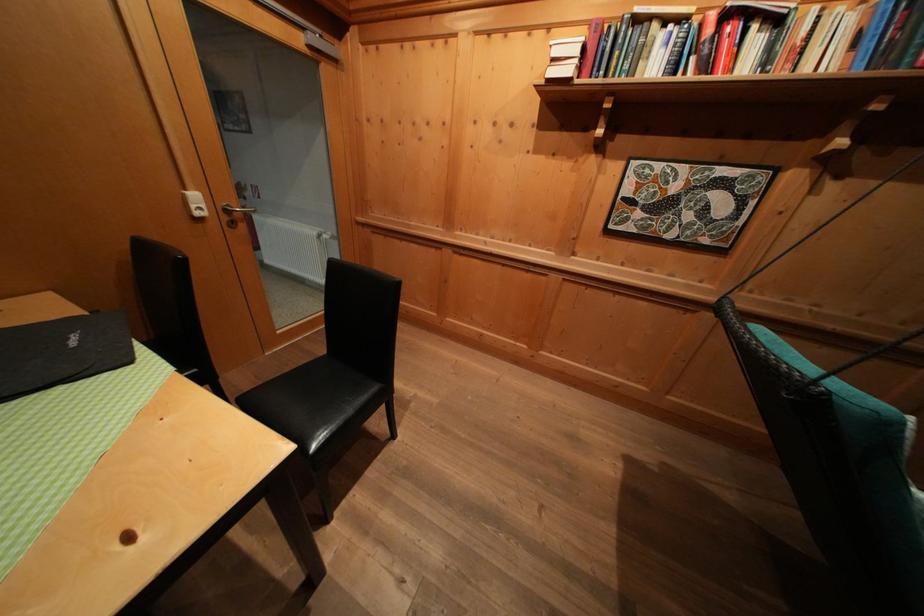
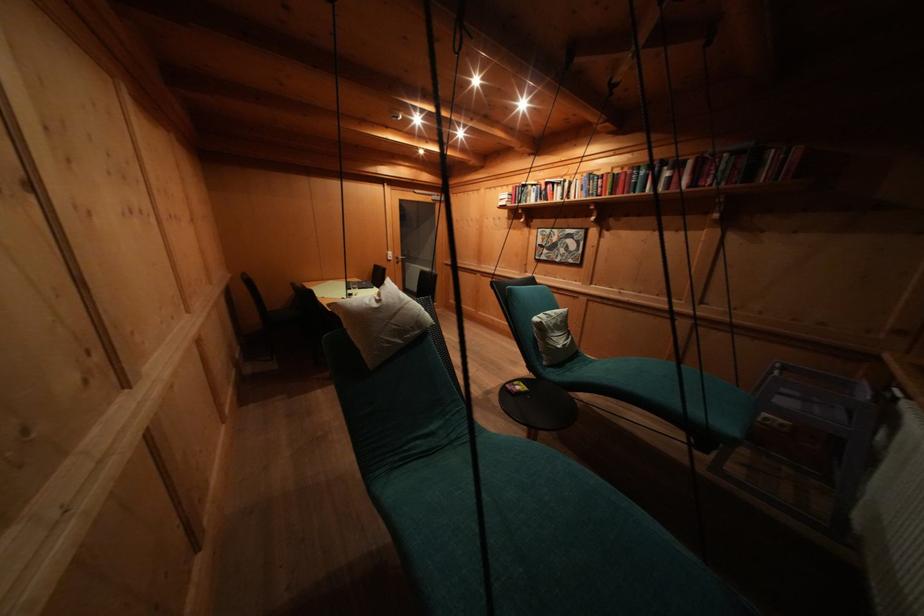
What movement of the cameraman would produce the second image?

The cameraman walked toward right, backward.